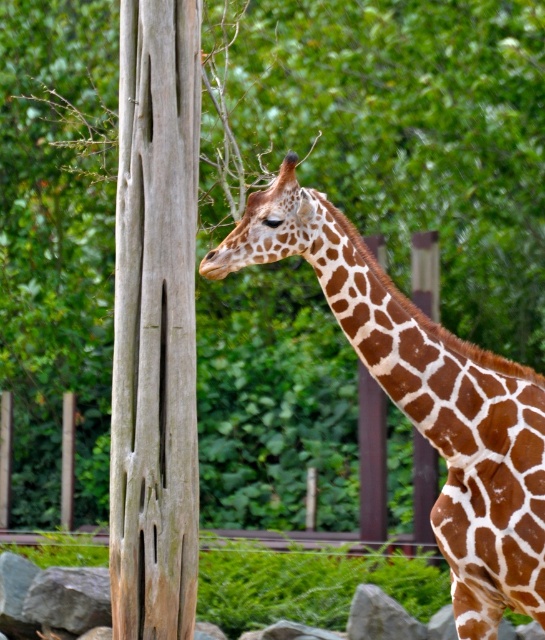
Question: Is weathered wood tree trunk at left thinner than brown spotted giraffe at center?

Choices:
 (A) yes
 (B) no

Answer: (A)

Question: Which of the following is the closest to the observer?

Choices:
 (A) weathered wood tree trunk at left
 (B) brown spotted giraffe at center

Answer: (B)

Question: Can you confirm if weathered wood tree trunk at left is smaller than brown spotted giraffe at center?

Choices:
 (A) no
 (B) yes

Answer: (B)

Question: Is weathered wood tree trunk at left wider than brown spotted giraffe at center?

Choices:
 (A) no
 (B) yes

Answer: (A)

Question: Which point is closer to the camera?

Choices:
 (A) (397, 291)
 (B) (130, 44)

Answer: (B)